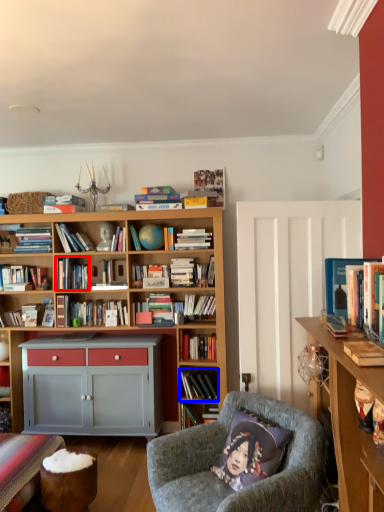
Question: Which point is further to the camera, book (highlighted by a red box) or book (highlighted by a blue box)?

Choices:
 (A) book
 (B) book

Answer: (A)